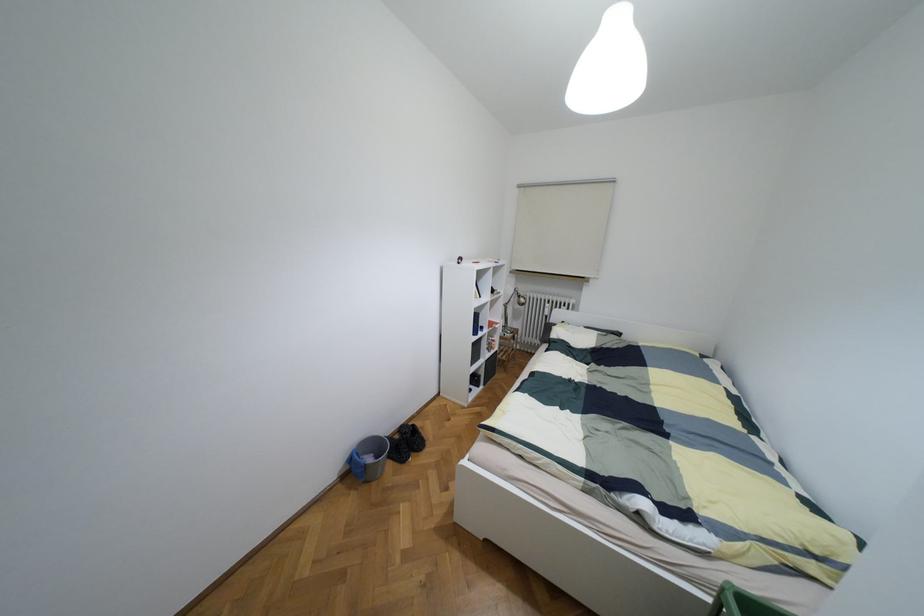
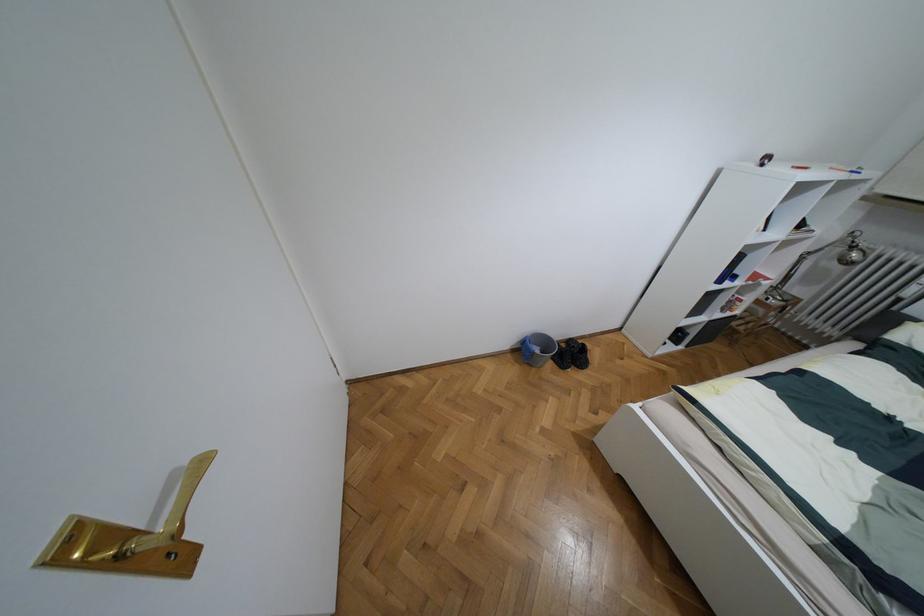
The point at (517,296) is marked in the first image. Where is the corresponding point in the second image?

(852, 246)